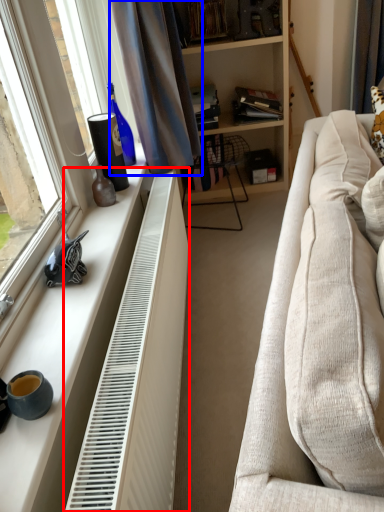
Question: Which point is closer to the camera, radiator (highlighted by a red box) or curtain (highlighted by a blue box)?

Choices:
 (A) radiator
 (B) curtain

Answer: (A)